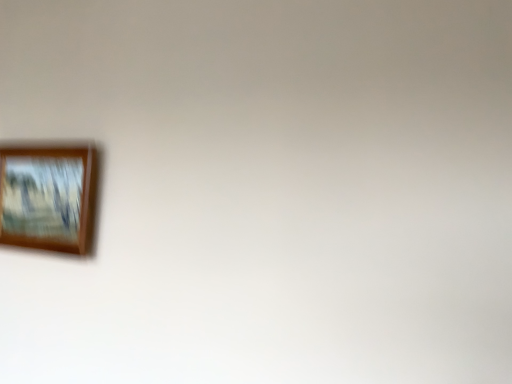
Describe the element at coordinates (47, 196) in the screenshot. I see `wooden picture frame at left` at that location.

Find the location of a particular element. This screenshot has width=512, height=384. wooden picture frame at left is located at coordinates (47, 196).

This screenshot has height=384, width=512. What are the coordinates of `wooden picture frame at left` in the screenshot? It's located at (47, 196).